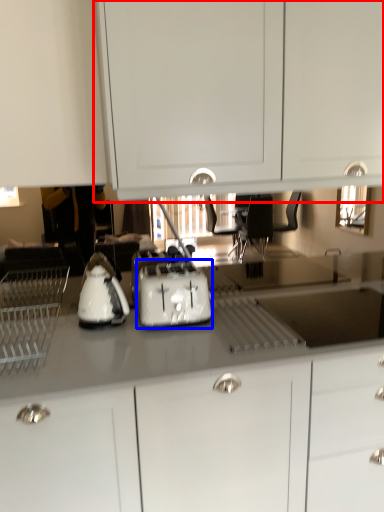
Question: Which of the following is the farthest to the observer, cabinetry (highlighted by a red box) or toaster (highlighted by a blue box)?

Choices:
 (A) cabinetry
 (B) toaster

Answer: (B)